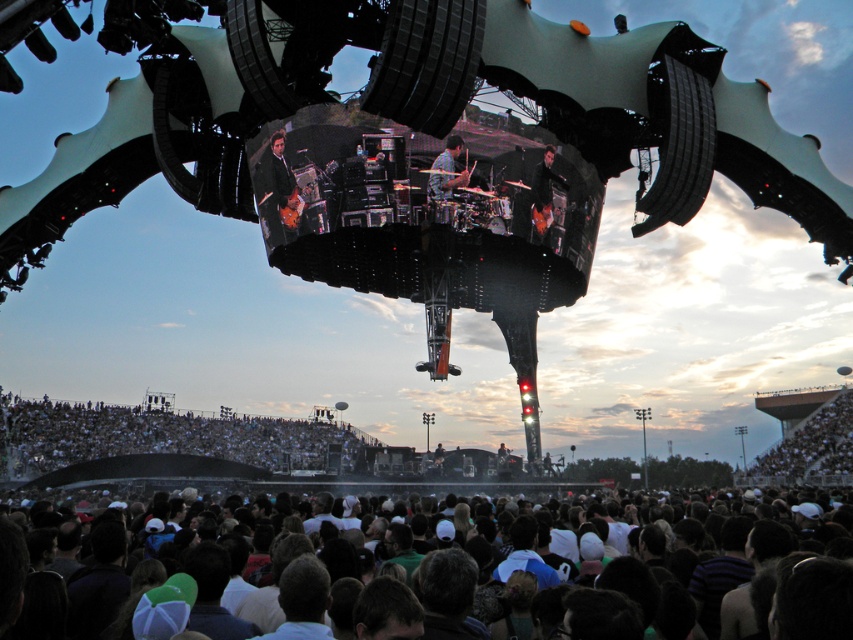
You are a stagehand standing at the edge of the stage where the shiny black guitar at center is placed. You need to pass a microphone to a performer who is part of the white fabric crowd at lower center. Considering the distance between you and the crowd, can you throw the microphone directly to them without it hitting the stage structure?

The white fabric crowd at lower center is 65.01 meters away from the shiny black guitar at center. Since this distance is quite large, throwing a microphone that far would be extremely difficult and likely result in it hitting the stage structure or missing the target entirely. A safer method, such as using a microphone stand or a crew member to relay it, would be more reliable.

From the picture: You are a photographer at the concert and want to capture both the shiny black guitar at center and the smooth skin drumsticks at center in a single frame. Which object should you focus on first to ensure both are in the frame?

The shiny black guitar at center is bigger than the smooth skin drumsticks at center, so you should focus on the shiny black guitar at center first to ensure both fit in the frame.

You are at the concert venue and want to find a good spot to watch the stage. The stage is located in the middle ground. Where should you stand relative to the white fabric crowd at lower center to have an unobstructed view?

To have an unobstructed view of the stage, you should stand behind the white fabric crowd at lower center since they are positioned at point (169, 436), which is closer to the stage. Standing behind them would place you in a better position to see over the crowd.